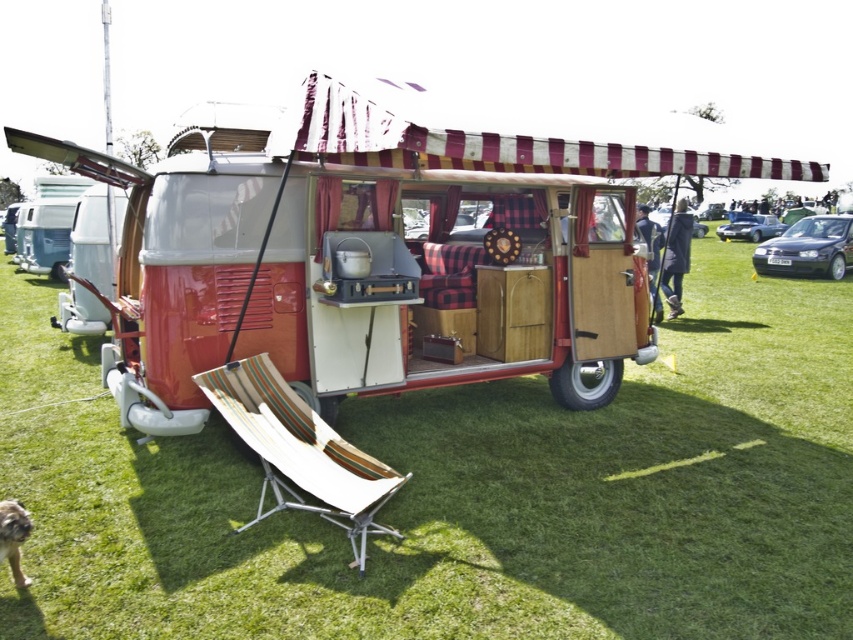
Question: Can you confirm if green grassy at center is positioned to the right of beige fabric chair at lower center?

Choices:
 (A) no
 (B) yes

Answer: (B)

Question: Observing the image, what is the correct spatial positioning of brown fur dog at lower left in reference to shiny silver car at upper right?

Choices:
 (A) right
 (B) left

Answer: (B)

Question: Does dark blue metallic sedan at right appear under brown fur dog at lower left?

Choices:
 (A) no
 (B) yes

Answer: (A)

Question: Which of the following is the closest to the observer?

Choices:
 (A) (767, 252)
 (B) (488, 552)
 (C) (556, 284)
 (D) (756, 225)

Answer: (B)

Question: Estimate the real-world distances between objects in this image. Which object is farther from the green grassy at center?

Choices:
 (A) beige fabric chair at lower center
 (B) dark blue metallic sedan at right

Answer: (B)

Question: Estimate the real-world distances between objects in this image. Which object is closer to the brown fur dog at lower left?

Choices:
 (A) green grassy at center
 (B) matte red camper van at center
 (C) shiny silver car at upper right
 (D) beige fabric chair at lower center

Answer: (D)